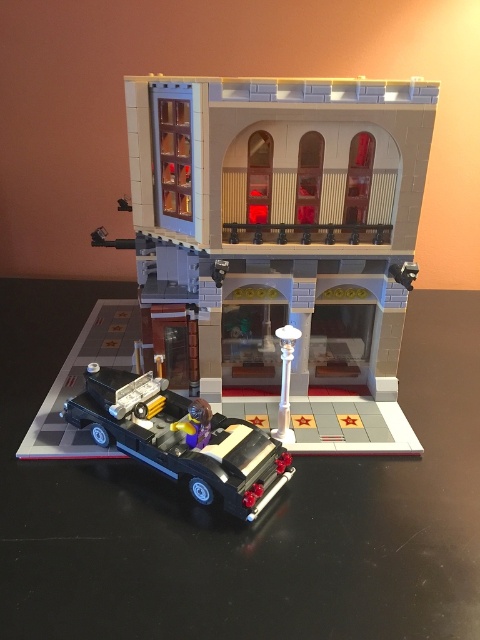
Between point (178, 182) and point (132, 396), which one is positioned in front?

Point (132, 396) is more forward.

Does matte gray building at center have a greater width compared to black plastic car at lower left?

Indeed, matte gray building at center has a greater width compared to black plastic car at lower left.

Is point (331, 99) more distant than point (215, 432)?

That is False.

The height and width of the screenshot is (640, 480). Identify the location of matte gray building at center. (278, 218).